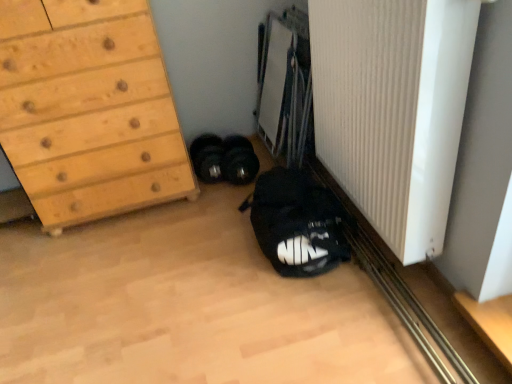
Where is `vacant point to the left of black fabric backpack at lower center`? The height and width of the screenshot is (384, 512). vacant point to the left of black fabric backpack at lower center is located at coordinates point(195,249).